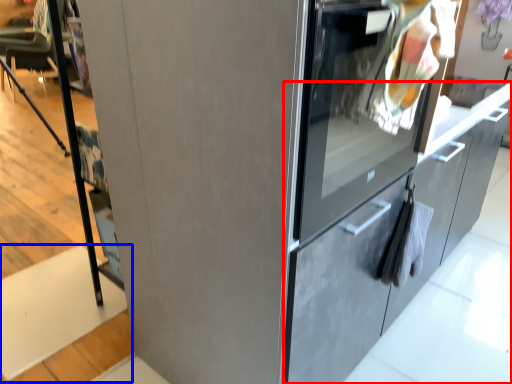
Question: Among these objects, which one is farthest to the camera, cabinetry (highlighted by a red box) or stair (highlighted by a blue box)?

Choices:
 (A) cabinetry
 (B) stair

Answer: (B)